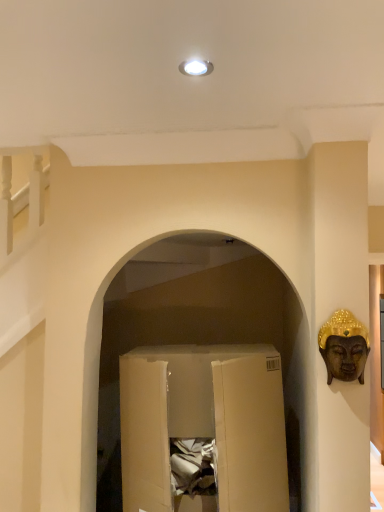
Question: Are cardboard box at center and gold textured buddha head at right making contact?

Choices:
 (A) no
 (B) yes

Answer: (A)

Question: From a real-world perspective, does cardboard box at center stand above gold textured buddha head at right?

Choices:
 (A) yes
 (B) no

Answer: (B)

Question: Is cardboard box at center completely or partially outside of gold textured buddha head at right?

Choices:
 (A) no
 (B) yes

Answer: (B)

Question: Considering the relative positions of cardboard box at center and gold textured buddha head at right in the image provided, is cardboard box at center behind gold textured buddha head at right?

Choices:
 (A) no
 (B) yes

Answer: (B)

Question: Considering the relative positions of cardboard box at center and gold textured buddha head at right in the image provided, is cardboard box at center to the right of gold textured buddha head at right from the viewer's perspective?

Choices:
 (A) no
 (B) yes

Answer: (A)

Question: Does cardboard box at center contain gold textured buddha head at right?

Choices:
 (A) no
 (B) yes

Answer: (A)

Question: Is cardboard box at center located within gold textured buddha head at right?

Choices:
 (A) yes
 (B) no

Answer: (B)

Question: Considering the relative sizes of gold textured buddha head at right and cardboard box at center in the image provided, is gold textured buddha head at right taller than cardboard box at center?

Choices:
 (A) yes
 (B) no

Answer: (B)

Question: Does gold textured buddha head at right have a lesser width compared to cardboard box at center?

Choices:
 (A) no
 (B) yes

Answer: (B)

Question: Does gold textured buddha head at right have a lesser height compared to cardboard box at center?

Choices:
 (A) yes
 (B) no

Answer: (A)

Question: Can you confirm if gold textured buddha head at right is bigger than cardboard box at center?

Choices:
 (A) no
 (B) yes

Answer: (A)

Question: Is gold textured buddha head at right in contact with cardboard box at center?

Choices:
 (A) no
 (B) yes

Answer: (A)

Question: Considering the positions of gold textured buddha head at right and cardboard box at center in the image, is gold textured buddha head at right taller or shorter than cardboard box at center?

Choices:
 (A) tall
 (B) short

Answer: (B)